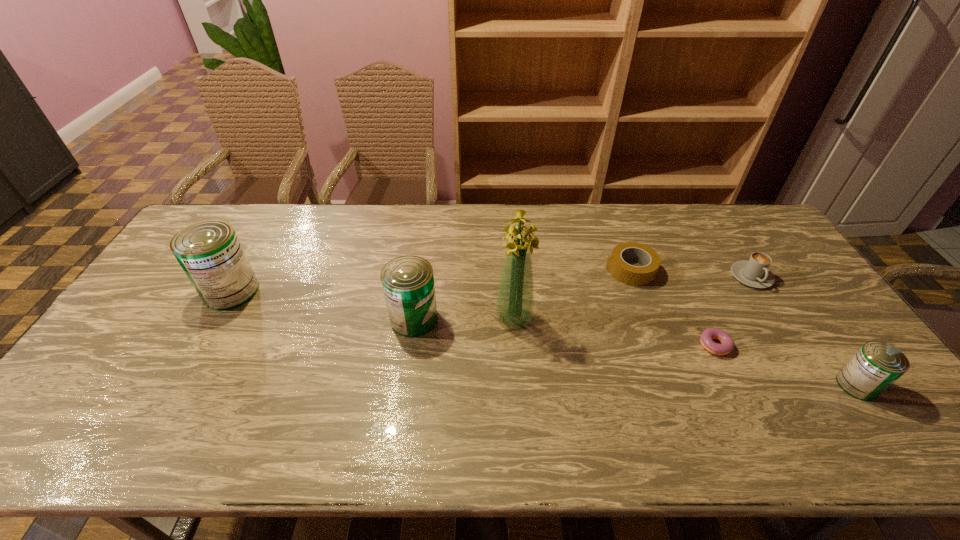
At what (x,y) coordinates should I click in order to perform the action: click on vacant space situated on the left of the third object from right to left. Please return your answer as a coordinate pair (x, y). Looking at the image, I should click on (640, 346).

Locate an element on the screen. object that is at the near edge is located at coordinates (876, 365).

Locate an element on the screen. The width and height of the screenshot is (960, 540). can present at the right edge is located at coordinates (876, 365).

Find the location of a particular element. cappuccino at the right edge is located at coordinates (755, 273).

Locate an element on the screen. object situated at the near right corner is located at coordinates (876, 365).

Locate an element on the screen. This screenshot has height=540, width=960. vacant region at the far edge of the desktop is located at coordinates (370, 235).

Where is `vacant space at the near edge`? Image resolution: width=960 pixels, height=540 pixels. vacant space at the near edge is located at coordinates (311, 397).

Where is `free space at the left edge of the desktop`? free space at the left edge of the desktop is located at coordinates (185, 287).

Where is `free space at the right edge of the desktop`? free space at the right edge of the desktop is located at coordinates (826, 367).

The width and height of the screenshot is (960, 540). What are the coordinates of `free space at the far right corner of the desktop` in the screenshot? It's located at (731, 224).